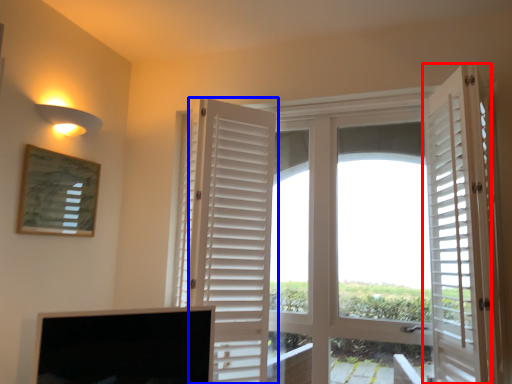
Question: Which point is further to the camera, door (highlighted by a red box) or door (highlighted by a blue box)?

Choices:
 (A) door
 (B) door

Answer: (B)